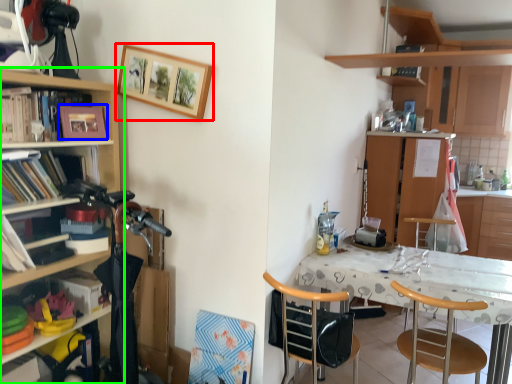
Question: Which object is positioned closest to picture frame (highlighted by a red box)? Select from picture frame (highlighted by a blue box) and cupboard (highlighted by a green box).

Choices:
 (A) picture frame
 (B) cupboard

Answer: (B)